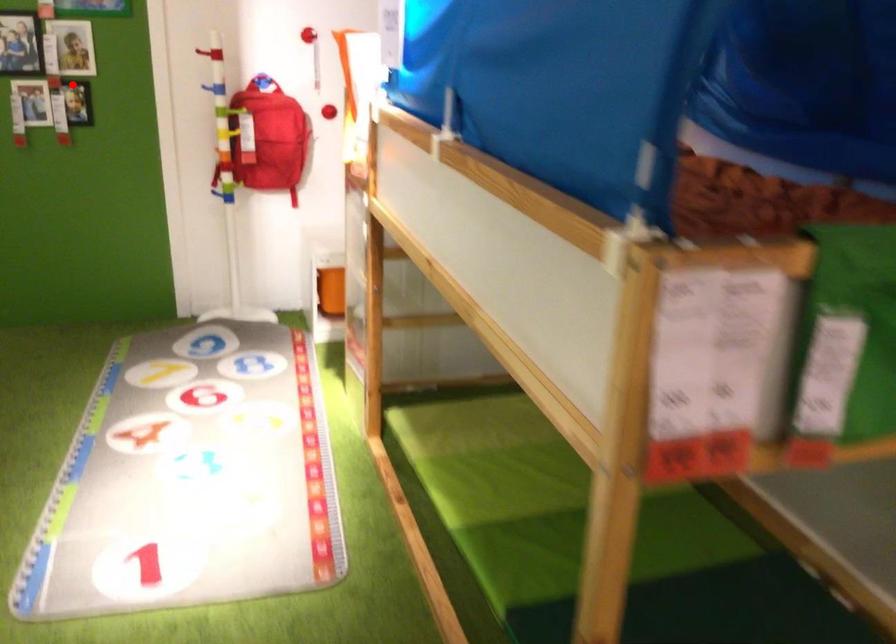
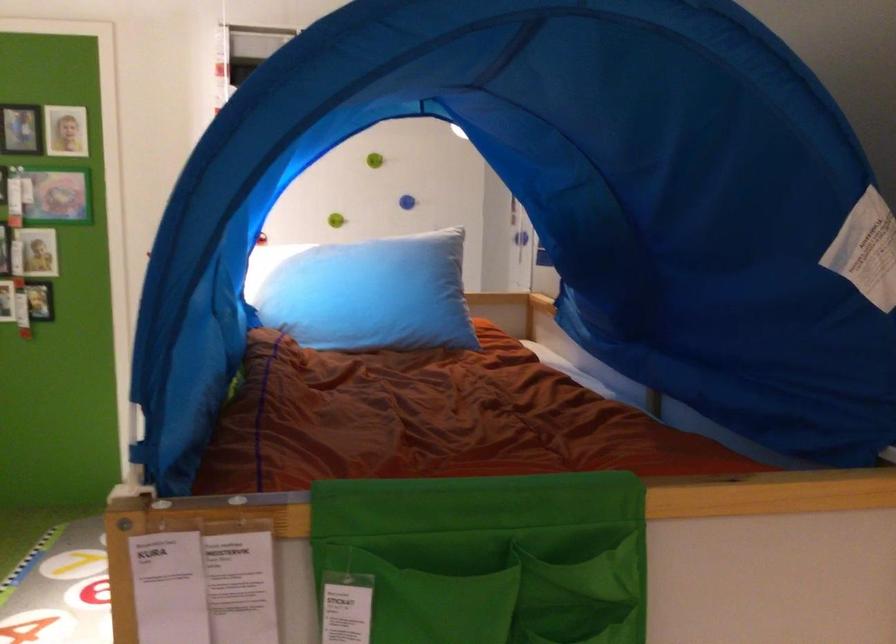
Where in the second image is the point corresponding to the highlighted location from the first image?

(39, 301)